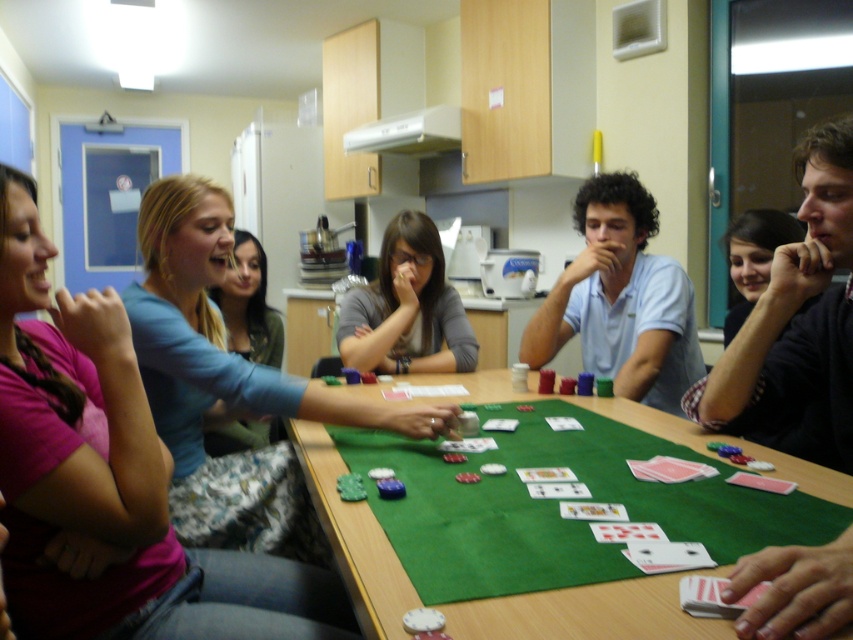
In the scene shown: Is green felt table at center below dark blue shirt at upper right?

Indeed, green felt table at center is positioned under dark blue shirt at upper right.

Does green felt table at center have a larger size compared to dark blue shirt at upper right?

Yes, green felt table at center is bigger than dark blue shirt at upper right.

Which is in front, point (341, 529) or point (732, 256)?

Point (341, 529) is more forward.

Identify the location of green felt table at center. The height and width of the screenshot is (640, 853). (583, 612).

Does pink fabric shirt at left appear over matte gray shirt at center?

Actually, pink fabric shirt at left is below matte gray shirt at center.

Which is behind, point (91, 349) or point (474, 344)?

Point (474, 344)

The image size is (853, 640). Find the location of `pink fabric shirt at left`. pink fabric shirt at left is located at coordinates (112, 477).

Looking at this image, does pink fabric shirt at left have a greater height compared to black matte shirt at center?

Indeed, pink fabric shirt at left has a greater height compared to black matte shirt at center.

Looking at this image, between pink fabric shirt at left and black matte shirt at center, which one has less height?

black matte shirt at center is shorter.

What do you see at coordinates (112, 477) in the screenshot? I see `pink fabric shirt at left` at bounding box center [112, 477].

Where is `pink fabric shirt at left`? pink fabric shirt at left is located at coordinates (112, 477).